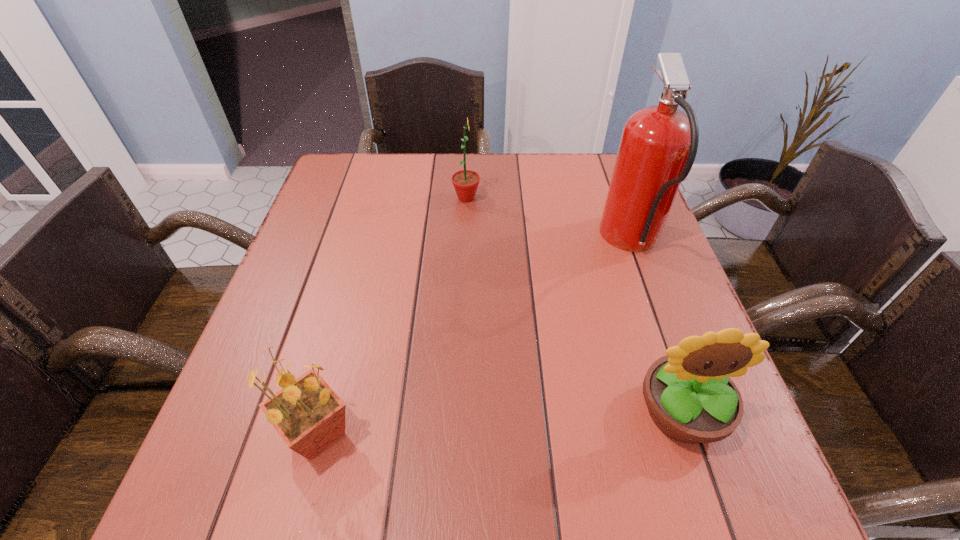
You are a GUI agent. You are given a task and a screenshot of the screen. Output one action in this format:
    pyautogui.click(x=<x>, y=<y>)
    Task: Click on the tallest object
    
    Given the screenshot: What is the action you would take?
    pyautogui.click(x=658, y=146)

Find the location of a particular element. Image resolution: width=960 pixels, height=540 pixels. fire extinguisher is located at coordinates (658, 146).

The image size is (960, 540). Find the location of `the rightmost sunflower`. the rightmost sunflower is located at coordinates (690, 397).

At what (x,y) coordinates should I click in order to perform the action: click on the farthest sunflower. Please return your answer as a coordinate pair (x, y). This screenshot has width=960, height=540. Looking at the image, I should click on (465, 182).

This screenshot has height=540, width=960. Find the location of `the second sunflower from left to right`. the second sunflower from left to right is located at coordinates (465, 182).

Locate an element on the screen. The height and width of the screenshot is (540, 960). the leftmost object is located at coordinates (308, 415).

Where is `vacant space located with the handle and nozzle on the second farthest object`? vacant space located with the handle and nozzle on the second farthest object is located at coordinates (x=475, y=241).

This screenshot has height=540, width=960. I want to click on vacant region located 0.200m with the handle and nozzle on the second farthest object, so click(520, 241).

Identify the location of vacant space located 0.230m with the handle and nozzle on the second farthest object. Image resolution: width=960 pixels, height=540 pixels. (508, 241).

Identify the location of free point located on the face of the rightmost sunflower. This screenshot has height=540, width=960. (716, 516).